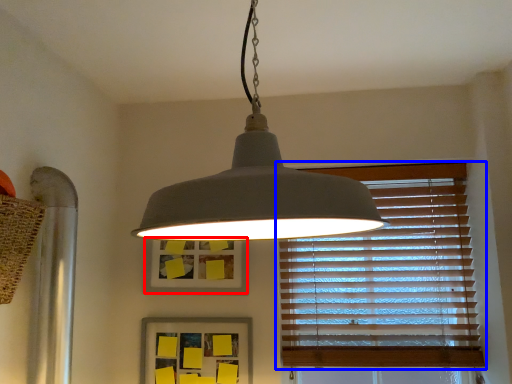
Question: Which object appears farthest to the camera in this image, picture frame (highlighted by a red box) or window blind (highlighted by a blue box)?

Choices:
 (A) picture frame
 (B) window blind

Answer: (A)